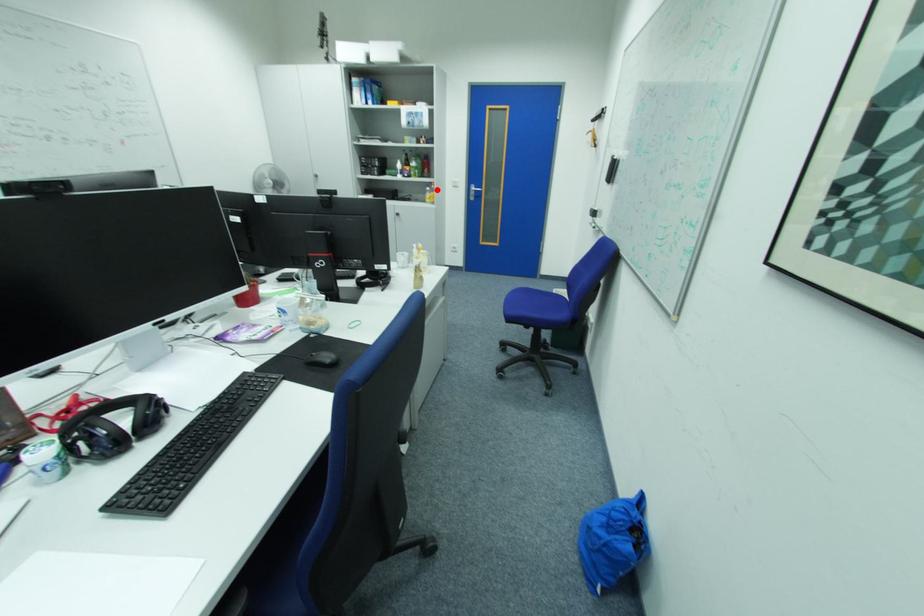
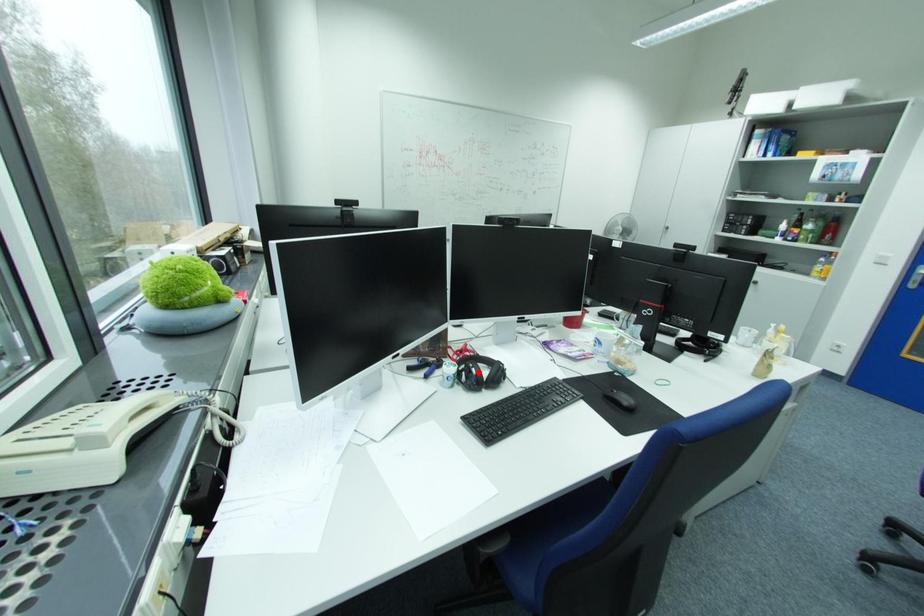
I am providing you with two images of the same scene from different viewpoints. A red point is marked on the first image and another point is marked on the second image. Is the red point in image1 aligned with the point shown in image2?

No